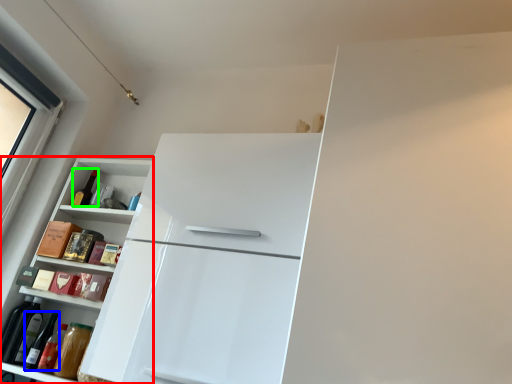
Question: Considering the real-world distances, which object is closest to cabinetry (highlighted by a red box)? wine bottle (highlighted by a blue box) or bottle (highlighted by a green box).

Choices:
 (A) wine bottle
 (B) bottle

Answer: (B)